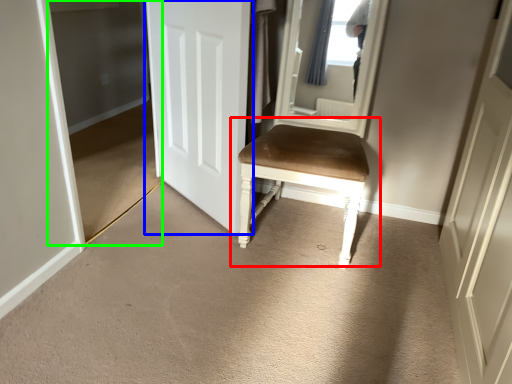
Question: Estimate the real-world distances between objects in this image. Which object is closer to chair (highlighted by a red box), door (highlighted by a blue box) or glass door (highlighted by a green box)?

Choices:
 (A) door
 (B) glass door

Answer: (A)